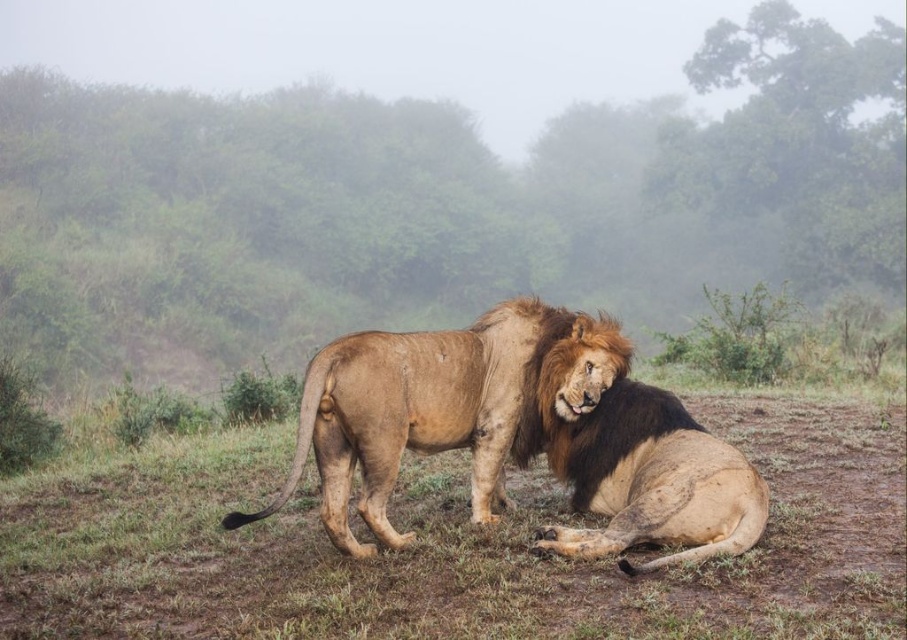
Can you confirm if fuzzy brown lion at center is positioned to the right of brown shaggy lion at center?

No, fuzzy brown lion at center is not to the right of brown shaggy lion at center.

Can you confirm if fuzzy brown lion at center is positioned below brown shaggy lion at center?

Indeed, fuzzy brown lion at center is positioned under brown shaggy lion at center.

This screenshot has width=907, height=640. I want to click on fuzzy brown lion at center, so click(454, 545).